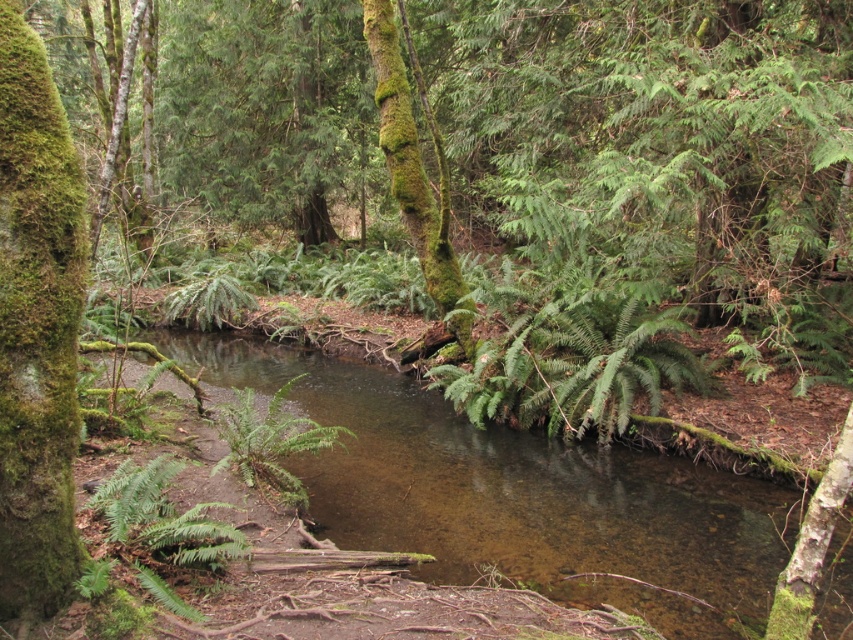
Does green mossy tree trunk at left lie in front of green mossy tree trunk at center?

That is True.

Can you confirm if green mossy tree trunk at left is bigger than green mossy tree trunk at center?

Actually, green mossy tree trunk at left might be smaller than green mossy tree trunk at center.

Which is behind, point (73, 490) or point (422, 259)?

The point (422, 259) is more distant.

Identify the location of green mossy tree trunk at left. This screenshot has height=640, width=853. (36, 326).

Who is positioned more to the right, clear water stream at center or green mossy tree trunk at left?

Positioned to the right is clear water stream at center.

Who is higher up, clear water stream at center or green mossy tree trunk at left?

Positioned higher is green mossy tree trunk at left.

Locate an element on the screen. The image size is (853, 640). clear water stream at center is located at coordinates click(514, 493).

Does clear water stream at center appear on the left side of green mossy tree trunk at center?

Correct, you'll find clear water stream at center to the left of green mossy tree trunk at center.

Which of these two, clear water stream at center or green mossy tree trunk at center, stands shorter?

With less height is clear water stream at center.

Is point (700, 588) positioned behind point (453, 292)?

No, (700, 588) is closer to viewer.

The width and height of the screenshot is (853, 640). I want to click on clear water stream at center, so click(x=514, y=493).